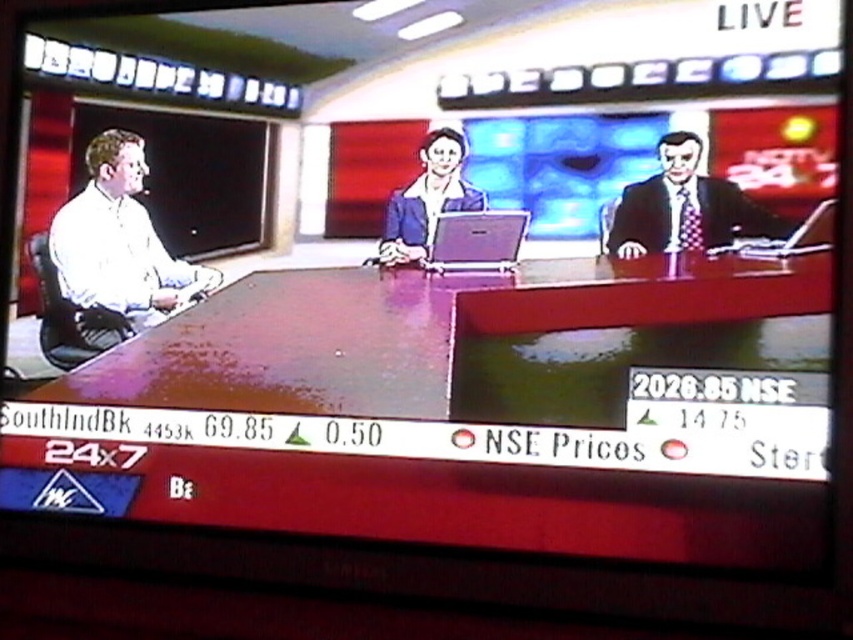
Can you confirm if matte blue blazer at center is positioned below matte black laptop at right?

Incorrect, matte blue blazer at center is not positioned below matte black laptop at right.

Consider the image. Can you confirm if matte blue blazer at center is thinner than matte black laptop at right?

No, matte blue blazer at center is not thinner than matte black laptop at right.

The image size is (853, 640). In order to click on matte blue blazer at center in this screenshot , I will do `click(428, 198)`.

Is silver metallic laptop at center shorter than matte black laptop at right?

Incorrect, silver metallic laptop at center's height does not fall short of matte black laptop at right's.

You are a GUI agent. You are given a task and a screenshot of the screen. Output one action in this format:
    pyautogui.click(x=<x>, y=<y>)
    Task: Click on the silver metallic laptop at center
    
    Given the screenshot: What is the action you would take?
    pyautogui.click(x=476, y=241)

Image resolution: width=853 pixels, height=640 pixels. Identify the location of silver metallic laptop at center. (476, 241).

Between matte black suit at upper right and matte blue blazer at center, which one appears on the right side from the viewer's perspective?

Positioned to the right is matte black suit at upper right.

Is matte black suit at upper right closer to the viewer compared to matte blue blazer at center?

Yes, matte black suit at upper right is closer to the viewer.

Does point (688, 198) come behind point (450, 147)?

No, it is in front of (450, 147).

Locate an element on the screen. The width and height of the screenshot is (853, 640). matte black suit at upper right is located at coordinates (685, 208).